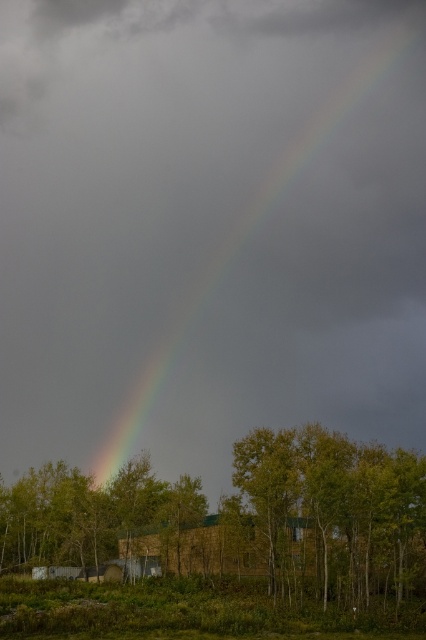
What do you see at coordinates (227, 532) in the screenshot?
I see `green leafy tree at lower center` at bounding box center [227, 532].

Is green leafy tree at lower center closer to camera compared to rainbow at upper center?

Yes.

The image size is (426, 640). Identify the location of green leafy tree at lower center. (227, 532).

Locate an element on the screen. green leafy tree at lower center is located at coordinates (227, 532).

Can you confirm if green leafy tree at lower center is wider than brown wooden hut at center?

Yes.

Is green leafy tree at lower center above brown wooden hut at center?

No, green leafy tree at lower center is not above brown wooden hut at center.

This screenshot has height=640, width=426. I want to click on green leafy tree at lower center, so click(x=227, y=532).

Does point (371, 68) come closer to viewer compared to point (170, 552)?

No, it is behind (170, 552).

Does rainbow at upper center have a lesser height compared to brown wooden hut at center?

No, rainbow at upper center is not shorter than brown wooden hut at center.

The image size is (426, 640). Identify the location of rainbow at upper center. (247, 236).